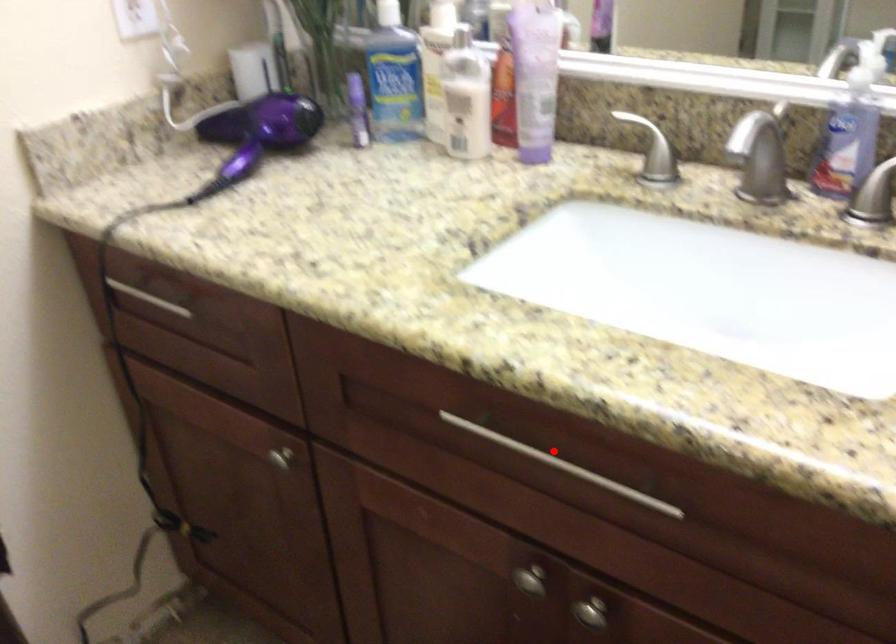
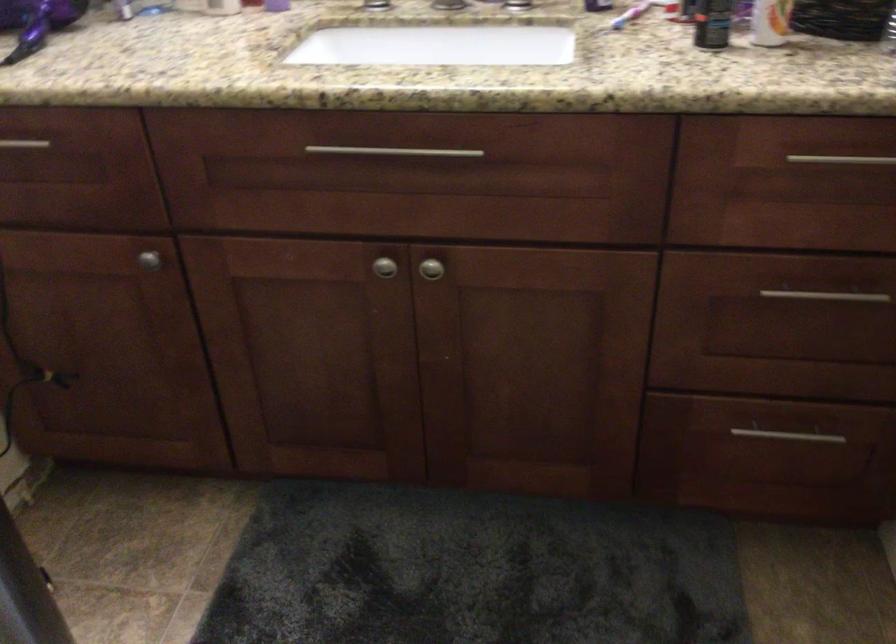
Question: I am providing you with two images of the same scene from different viewpoints. A red point is shown in image1. For the corresponding object point in image2, is it positioned nearer or farther from the camera?

Choices:
 (A) Nearer
 (B) Farther

Answer: (B)